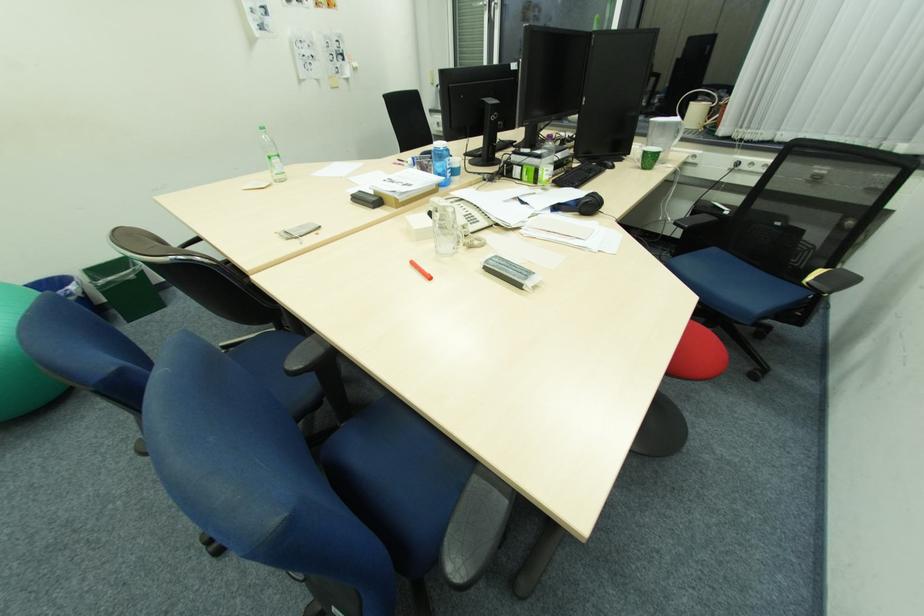
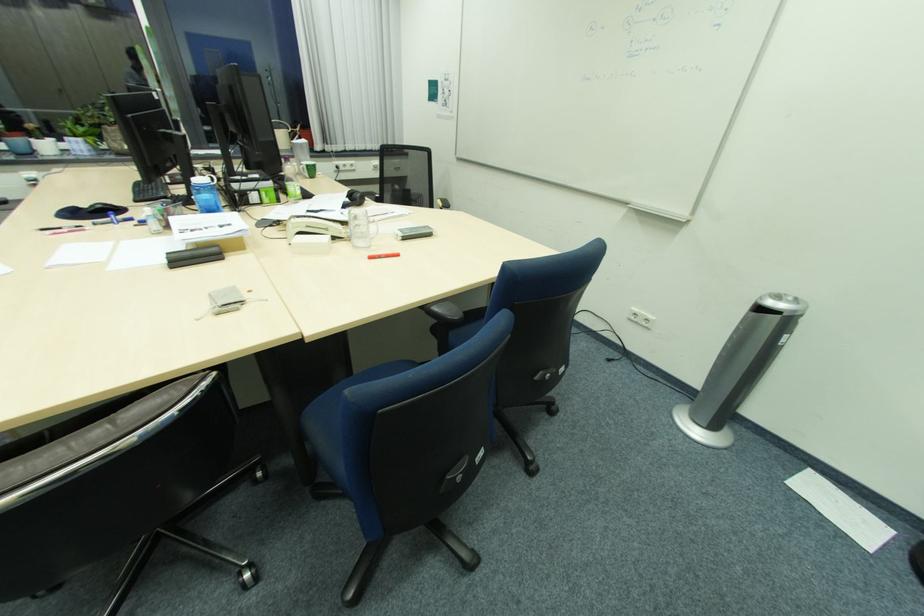
Find the pixel in the second image that matches [555,211] in the first image.

(349, 209)